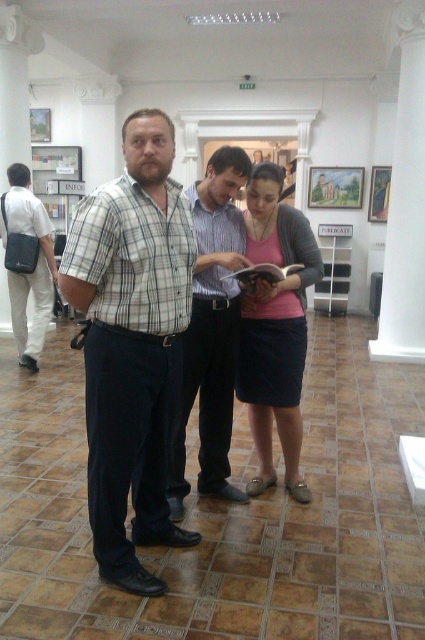
Is plaid shirt at center positioned at the back of matte black bag at left?

No.

Is plaid shirt at center closer to the viewer compared to matte black bag at left?

Yes, it is.

This screenshot has width=425, height=640. I want to click on plaid shirt at center, so click(x=212, y=330).

Locate an element on the screen. plaid shirt at center is located at coordinates (212, 330).

Is plaid cotton shirt at center above matte black bag at left?

No.

Which is in front, point (96, 445) or point (42, 348)?

Point (96, 445) is in front.

Describe the element at coordinates (133, 344) in the screenshot. I see `plaid cotton shirt at center` at that location.

You are a GUI agent. You are given a task and a screenshot of the screen. Output one action in this format:
    pyautogui.click(x=<x>, y=<y>)
    Task: Click on the plaid cotton shirt at center
    
    Given the screenshot: What is the action you would take?
    pyautogui.click(x=133, y=344)

Is point (266, 424) more distant than point (243, 248)?

Yes, it is behind point (243, 248).

Is point (269, 442) closer to viewer compared to point (221, 474)?

No, (269, 442) is behind (221, 474).

Does point (260, 250) come closer to viewer compared to point (223, 436)?

Yes, point (260, 250) is in front of point (223, 436).

Locate an element on the screen. This screenshot has width=425, height=640. matte pink shirt at center is located at coordinates (274, 328).